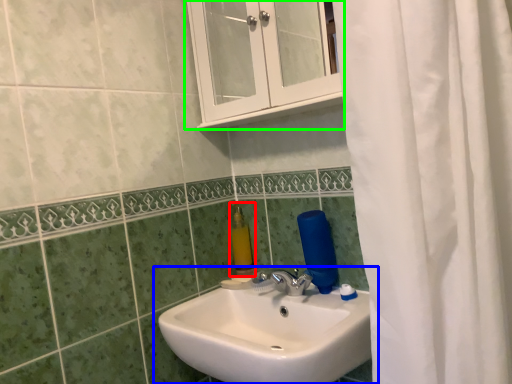
Question: Which is farther away from soap dispenser (highlighted by a red box)? sink (highlighted by a blue box) or medicine cabinet (highlighted by a green box)?

Choices:
 (A) sink
 (B) medicine cabinet

Answer: (B)